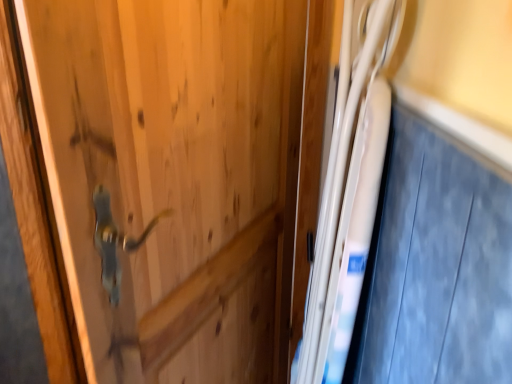
The image size is (512, 384). Identify the location of empty space that is ontop of white glossy bed at right. (443, 85).